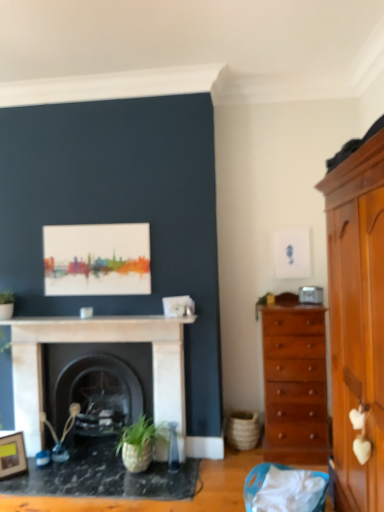
Locate an element on the screen. free spot in front of wooden picture frame at lower left is located at coordinates (8, 481).